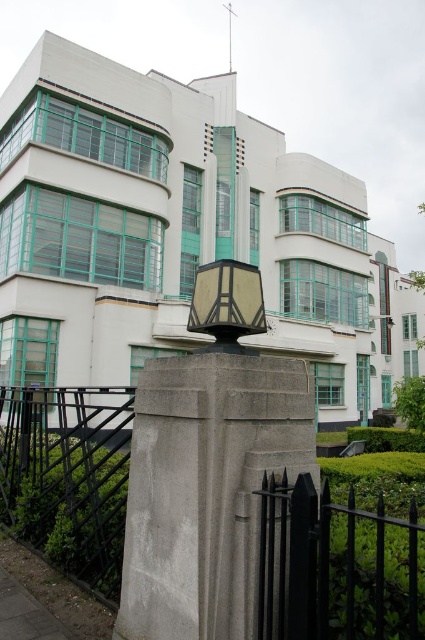
Does green leafy hedge at lower left have a smaller size compared to matte beige lamp at center?

Incorrect, green leafy hedge at lower left is not smaller in size than matte beige lamp at center.

Which is behind, point (110, 445) or point (221, 310)?

Point (110, 445)

Who is more forward, (8, 490) or (218, 310)?

Result: Point (218, 310) is in front.

Find the location of `green leafy hedge at lower left`. green leafy hedge at lower left is located at coordinates (68, 500).

Is gray concrete pillar at center bigger than matte beige lamp at center?

Yes.

Does gray concrete pillar at center appear over matte beige lamp at center?

Actually, gray concrete pillar at center is below matte beige lamp at center.

I want to click on gray concrete pillar at center, so click(x=206, y=488).

Locate an element on the screen. This screenshot has height=640, width=425. gray concrete pillar at center is located at coordinates (206, 488).

Can you confirm if black metal fence at lower center is taller than matte beige lamp at center?

Yes, black metal fence at lower center is taller than matte beige lamp at center.

Who is taller, black metal fence at lower center or matte beige lamp at center?

Standing taller between the two is black metal fence at lower center.

Does point (3, 419) come farther from viewer compared to point (226, 330)?

Yes.

The image size is (425, 640). In order to click on black metal fence at lower center in this screenshot , I will do `click(339, 564)`.